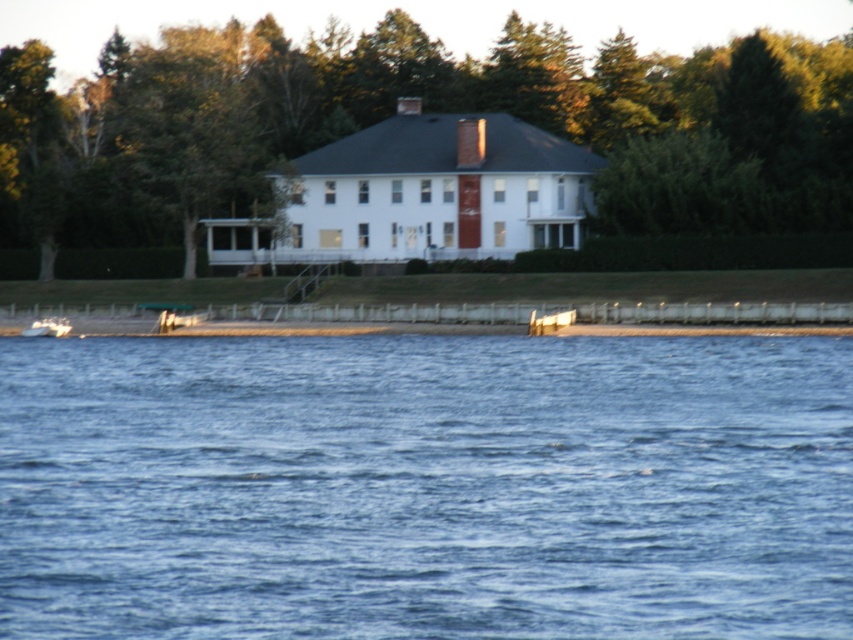
Is blue liquid water at center above white matte boat at lower left?

Incorrect, blue liquid water at center is not positioned above white matte boat at lower left.

Which is in front, point (154, 371) or point (51, 324)?

Positioned in front is point (154, 371).

Identify the location of blue liquid water at center. (425, 486).

You are a GUI agent. You are given a task and a screenshot of the screen. Output one action in this format:
    pyautogui.click(x=<x>, y=<y>)
    Task: Click on the blue liquid water at center
    
    Given the screenshot: What is the action you would take?
    pyautogui.click(x=425, y=486)

Describe the element at coordinates (425, 486) in the screenshot. This screenshot has height=640, width=853. I see `blue liquid water at center` at that location.

Which is below, blue liquid water at center or green leafy tree at center?

blue liquid water at center is below.

Does point (840, 458) come behind point (709, 76)?

No, (840, 458) is closer to viewer.

Locate an element on the screen. The height and width of the screenshot is (640, 853). blue liquid water at center is located at coordinates (425, 486).

Is point (799, 227) farther from viewer compared to point (41, 333)?

Yes, it is behind point (41, 333).

Find the location of a particular element. This screenshot has width=853, height=640. green leafy tree at center is located at coordinates (393, 113).